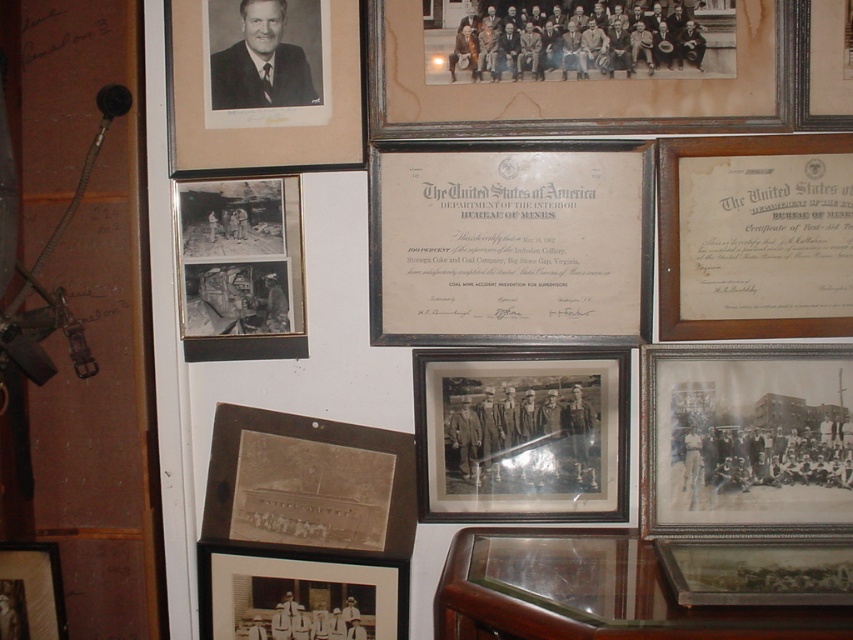
Is the position of matte paper certificate at center less distant than that of matte brown photo frame at lower left?

Yes, matte paper certificate at center is in front of matte brown photo frame at lower left.

Identify the location of matte paper certificate at center. The width and height of the screenshot is (853, 640). click(x=511, y=243).

Which is behind, point (250, 195) or point (286, 588)?

Point (286, 588)

Which is more to the right, black matte photograph at upper left or matte black photo frame at lower left?

matte black photo frame at lower left

Is point (239, 237) behind point (349, 625)?

No.

Locate an element on the screen. black matte photograph at upper left is located at coordinates (241, 269).

Does point (469, 33) come in front of point (772, 572)?

No, it is not.

Is point (502, 70) farther from viewer compared to point (735, 572)?

Yes, point (502, 70) is farther from viewer.

Who is more distant from viewer, (788, 67) or (846, 593)?

Positioned behind is point (788, 67).

Locate an element on the screen. wooden frame at upper center is located at coordinates pos(578,67).